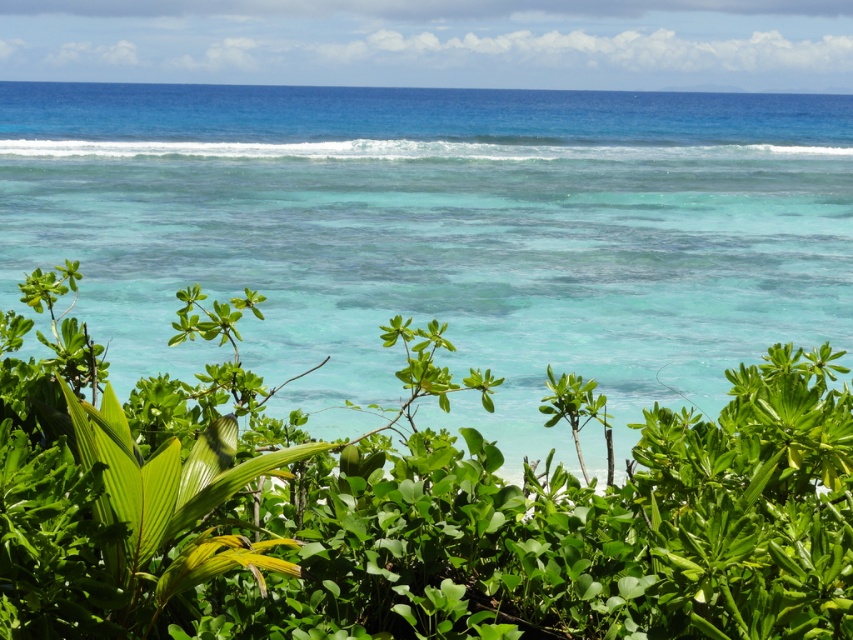
Is turquoise clear water at center taller than green leafy plant at center?

Yes, turquoise clear water at center is taller than green leafy plant at center.

Is turquoise clear water at center positioned before green leafy plant at center?

No, turquoise clear water at center is behind green leafy plant at center.

Where is `turquoise clear water at center`? The image size is (853, 640). turquoise clear water at center is located at coordinates (440, 234).